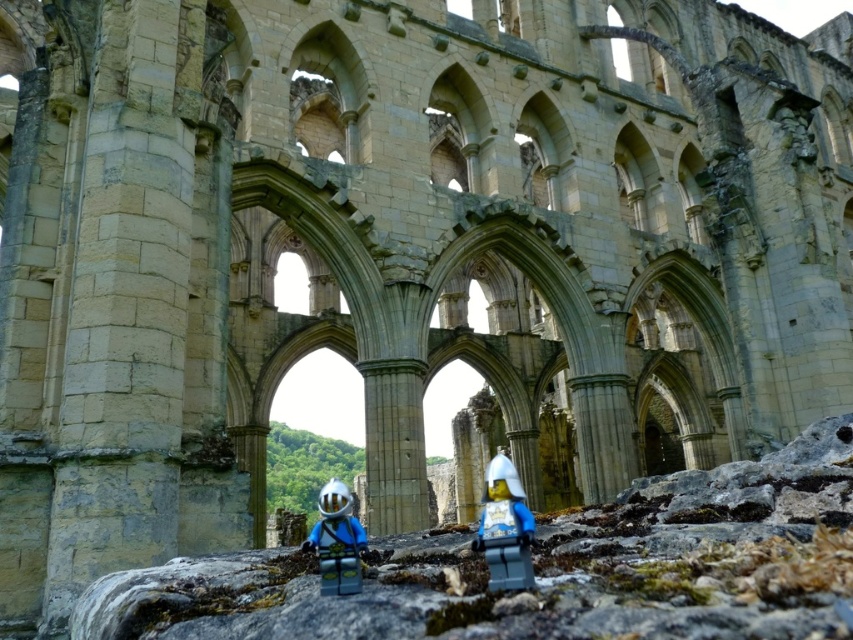
Who is more distant from viewer, [523,492] or [341,588]?

The point [523,492] is more distant.

Does smooth plastic helmet at center have a lesser width compared to matte blue plastic minifigure at center?

Yes, smooth plastic helmet at center is thinner than matte blue plastic minifigure at center.

Who is more distant from viewer, (508, 484) or (339, 572)?

The point (508, 484) is behind.

Locate an element on the screen. The image size is (853, 640). smooth plastic helmet at center is located at coordinates 505,528.